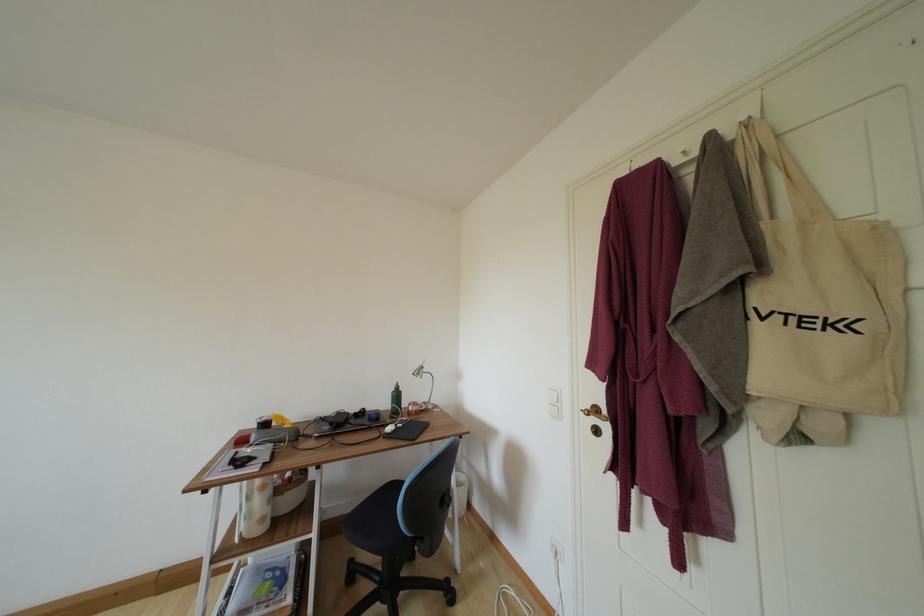
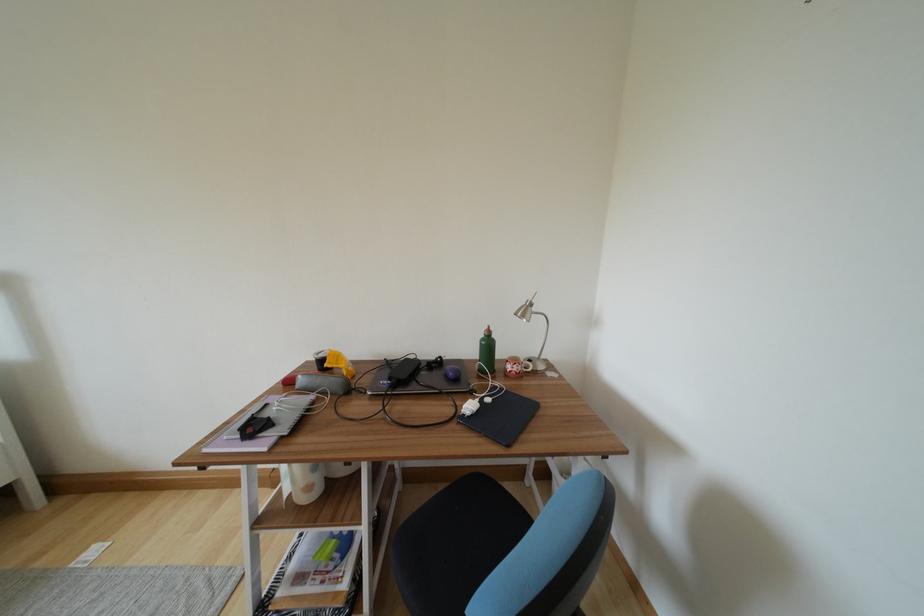
Where in the second image is the point corresponding to pixel 335 428 from the first image?

(395, 382)